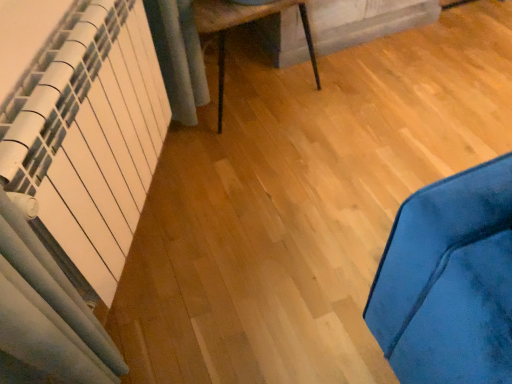
What are the coordinates of `free space below wooden table at center (from a real-world perspective)` in the screenshot? It's located at (257, 110).